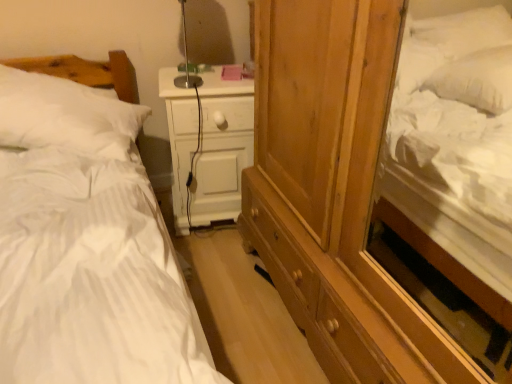
Question: Looking at their shapes, would you say white striped fabric bed at left is wider or thinner than white soft pillow at left?

Choices:
 (A) thin
 (B) wide

Answer: (B)

Question: Is white striped fabric bed at left to the left or to the right of white soft pillow at left in the image?

Choices:
 (A) right
 (B) left

Answer: (A)

Question: Which of these objects is positioned farthest from the white soft pillow at left?

Choices:
 (A) white striped fabric bed at left
 (B) white matte nightstand at center

Answer: (B)

Question: Estimate the real-world distances between objects in this image. Which object is closer to the white striped fabric bed at left?

Choices:
 (A) white matte nightstand at center
 (B) white soft pillow at left

Answer: (B)